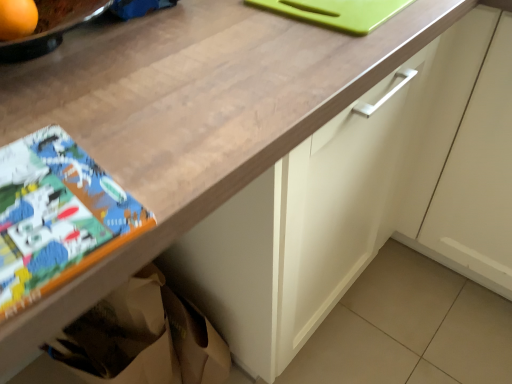
I want to click on vacant space behind matte paper comic book at lower left, so click(106, 109).